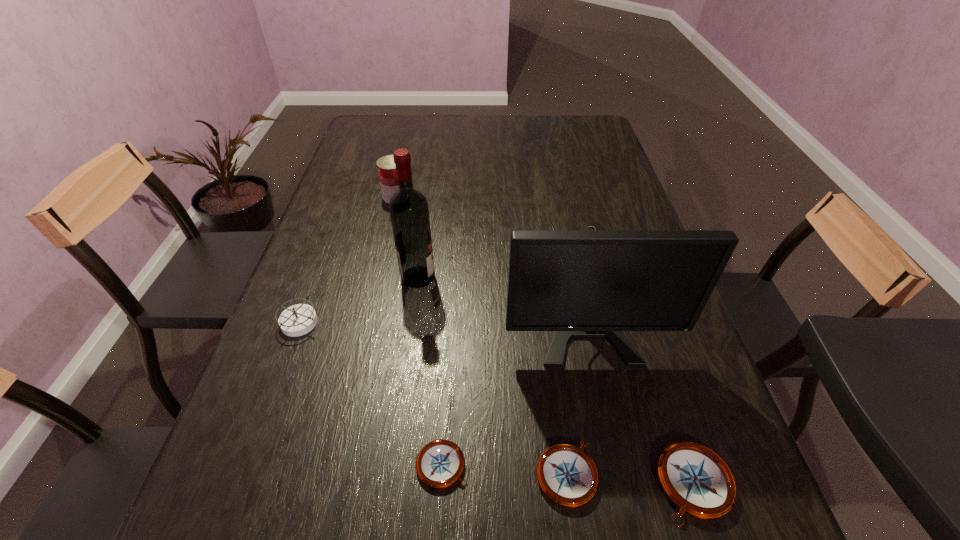
Locate an element on the screen. the fourth shortest object is located at coordinates (297, 320).

Identify the location of the farthest compass. This screenshot has height=540, width=960. (297, 320).

Locate an element on the screen. blank space located on the left of the shortest object is located at coordinates (336, 465).

Identify the location of blank area located on the left of the third compass from left to right. This screenshot has width=960, height=540. (466, 474).

I want to click on free space located 0.250m on the back of the fifth tallest object, so click(x=645, y=334).

Where is `free location located on the screen side of the computer monitor`? Image resolution: width=960 pixels, height=540 pixels. free location located on the screen side of the computer monitor is located at coordinates (612, 448).

Where is `vacant area located 0.140m on the front and back of the alcohol`? vacant area located 0.140m on the front and back of the alcohol is located at coordinates (492, 277).

You are a GUI agent. You are given a task and a screenshot of the screen. Output one action in this format:
    pyautogui.click(x=<x>, y=<y>)
    Task: Click on the vacant space located 0.400m on the front label of the can
    
    Given the screenshot: What is the action you would take?
    pyautogui.click(x=540, y=197)

Where is `free space located 0.390m on the right of the leftmost compass`? The width and height of the screenshot is (960, 540). free space located 0.390m on the right of the leftmost compass is located at coordinates (493, 323).

Image resolution: width=960 pixels, height=540 pixels. I want to click on can at the left edge, so click(x=386, y=167).